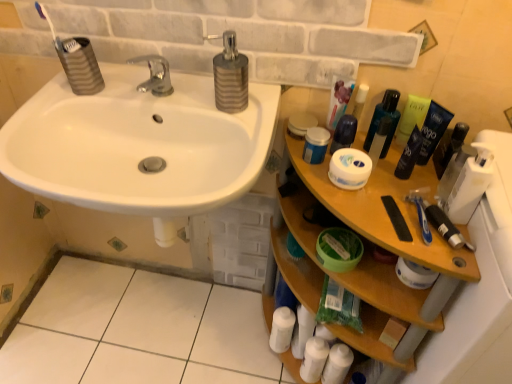
Question: Which direction should I rotate to face white matte lotion at lower center, the 2th toiletry when ordered from back to front, — up or down?

Choices:
 (A) up
 (B) down

Answer: (B)

Question: Are white glossy sink at upper left and white matte tube at upper right making contact?

Choices:
 (A) yes
 (B) no

Answer: (B)

Question: Is white glossy sink at upper left thinner than white matte tube at upper right?

Choices:
 (A) no
 (B) yes

Answer: (A)

Question: Does white glossy sink at upper left have a lesser height compared to white matte tube at upper right?

Choices:
 (A) no
 (B) yes

Answer: (A)

Question: From the image's perspective, is white glossy sink at upper left located beneath white matte tube at upper right?

Choices:
 (A) no
 (B) yes

Answer: (B)

Question: Considering the relative positions of white glossy sink at upper left and white matte tube at upper right in the image provided, is white glossy sink at upper left to the left of white matte tube at upper right from the viewer's perspective?

Choices:
 (A) no
 (B) yes

Answer: (B)

Question: Can you confirm if white glossy sink at upper left is wider than white matte tube at upper right?

Choices:
 (A) no
 (B) yes

Answer: (B)

Question: From the image's perspective, is white matte lotion at lower center, acting as the 2th toiletry starting from the right, below dark blue plastic tube at upper right, placed as the 6th mouthwash when sorted from left to right?

Choices:
 (A) yes
 (B) no

Answer: (A)

Question: Can you confirm if white matte lotion at lower center, which is the 1th toiletry in bottom-to-top order, is positioned to the left of dark blue plastic tube at upper right, placed as the 6th mouthwash when sorted from left to right?

Choices:
 (A) no
 (B) yes

Answer: (B)

Question: Considering the relative sizes of white matte lotion at lower center, arranged as the third toiletry when viewed from the top, and dark blue plastic tube at upper right, marked as the second mouthwash in a right-to-left arrangement, in the image provided, is white matte lotion at lower center, arranged as the third toiletry when viewed from the top, bigger than dark blue plastic tube at upper right, marked as the second mouthwash in a right-to-left arrangement,?

Choices:
 (A) yes
 (B) no

Answer: (A)

Question: From a real-world perspective, is white matte lotion at lower center, the 2th toiletry when ordered from left to right, on dark blue plastic tube at upper right, marked as the second mouthwash in a right-to-left arrangement?

Choices:
 (A) no
 (B) yes

Answer: (A)

Question: Considering the relative sizes of white matte lotion at lower center, the 2th toiletry when ordered from back to front, and dark blue plastic tube at upper right, placed as the 6th mouthwash when sorted from left to right, in the image provided, is white matte lotion at lower center, the 2th toiletry when ordered from back to front, thinner than dark blue plastic tube at upper right, placed as the 6th mouthwash when sorted from left to right,?

Choices:
 (A) yes
 (B) no

Answer: (B)

Question: Are white matte lotion at lower center, the 2th toiletry when ordered from back to front, and dark blue plastic tube at upper right, marked as the second mouthwash in a right-to-left arrangement, beside each other?

Choices:
 (A) no
 (B) yes

Answer: (A)

Question: Considering the relative sizes of green plastic bottle at upper right, the 5th mouthwash when ordered from left to right, and white tile at lower left in the image provided, is green plastic bottle at upper right, the 5th mouthwash when ordered from left to right, thinner than white tile at lower left?

Choices:
 (A) no
 (B) yes

Answer: (B)